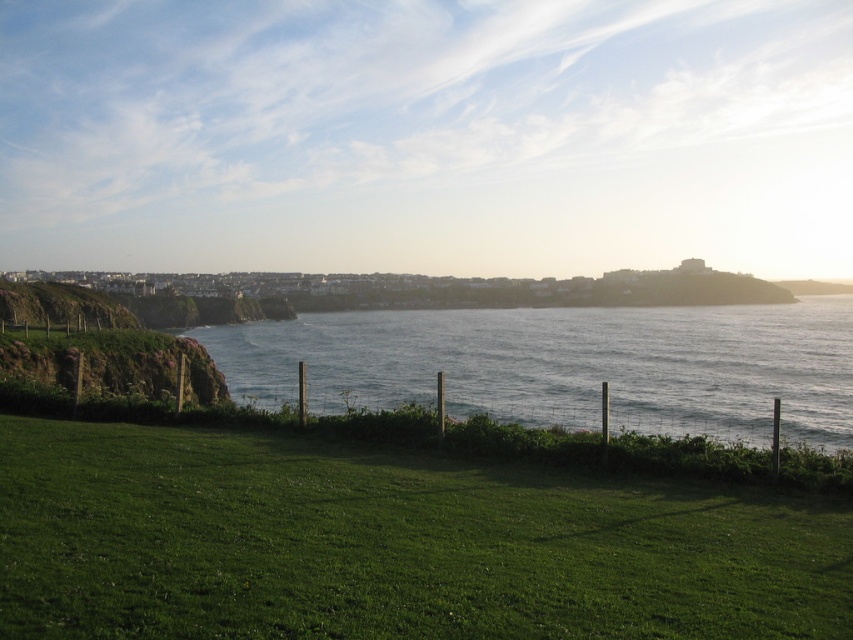
You are standing at the edge of the green grassy at lower center and want to walk towards the blue water at center. Is the path clear or blocked by any obstacles?

The green grassy at lower center is in front of the blue water at center, so the path is clear as there are no obstacles between them.

You are standing on the green grassy at lower center and want to walk towards the blue water at center. Which direction should you go?

The green grassy at lower center is shorter than blue water at center, so you should walk towards the direction of the blue water at center to reach it.